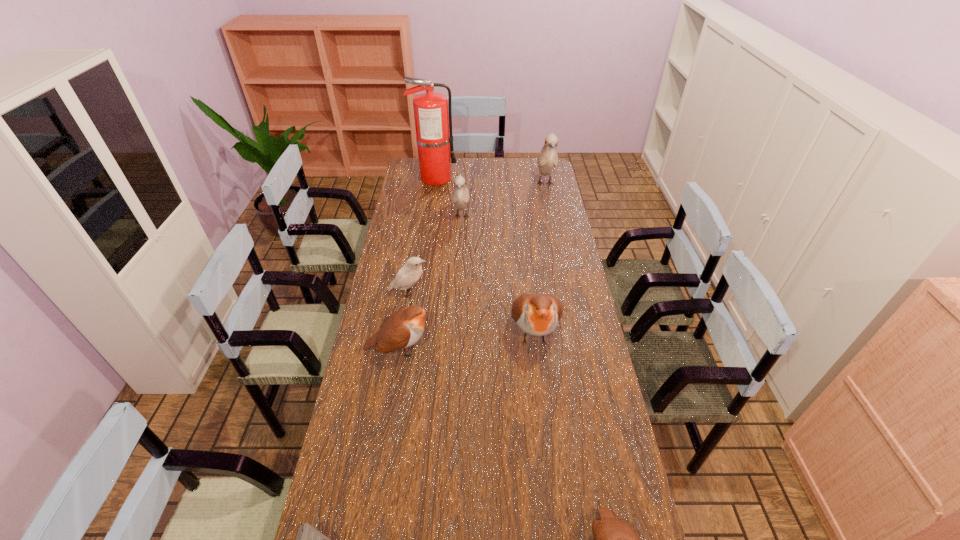
Where is `red fire extinguisher`? This screenshot has width=960, height=540. red fire extinguisher is located at coordinates (432, 123).

Locate an element on the screen. The height and width of the screenshot is (540, 960). the tallest object is located at coordinates pos(432,123).

I want to click on the second tallest object, so click(x=547, y=159).

Find the location of a particular element. This screenshot has height=540, width=960. the farthest white bird is located at coordinates (547, 159).

Where is `the biggest brown bird`? This screenshot has width=960, height=540. the biggest brown bird is located at coordinates (536, 314).

Where is `the second white bird from left to right`? The height and width of the screenshot is (540, 960). the second white bird from left to right is located at coordinates (460, 196).

Identify the location of the fourth bird from right to left. The width and height of the screenshot is (960, 540). (460, 196).

The image size is (960, 540). I want to click on the leftmost brown bird, so click(x=403, y=328).

The image size is (960, 540). I want to click on the leftmost white bird, so click(x=410, y=273).

The width and height of the screenshot is (960, 540). I want to click on the nearest white bird, so click(x=410, y=273).